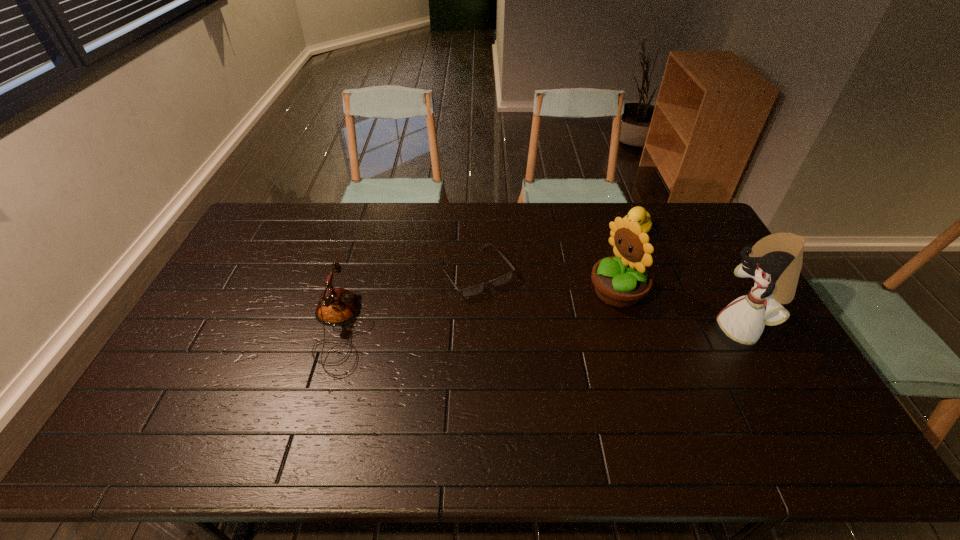
Where is `vacant area situated 0.150m at the front face of the rightmost object`? vacant area situated 0.150m at the front face of the rightmost object is located at coordinates (666, 329).

Locate an element on the screen. This screenshot has width=960, height=540. vacant space located 0.370m on the face of the second tallest object is located at coordinates (493, 352).

The image size is (960, 540). I want to click on vacant space situated 0.350m on the face of the second tallest object, so click(499, 349).

Image resolution: width=960 pixels, height=540 pixels. Identify the location of free space located on the face of the second tallest object. (554, 323).

At what (x,y) coordinates should I click in order to perform the action: click on vacant space located 0.170m on the front-facing side of the shortest object. Please return your answer as a coordinate pair (x, y). Looking at the image, I should click on (522, 336).

This screenshot has height=540, width=960. I want to click on vacant region located 0.210m on the front-facing side of the shortest object, so click(530, 346).

At what (x,y) coordinates should I click in order to perform the action: click on free space located on the front-facing side of the shortest object. Please return your answer as a coordinate pair (x, y). Image resolution: width=960 pixels, height=540 pixels. Looking at the image, I should click on (540, 359).

Where is `vacant space located 0.270m on the beak of the farthest object`? Image resolution: width=960 pixels, height=540 pixels. vacant space located 0.270m on the beak of the farthest object is located at coordinates (587, 278).

Where is `free space located on the beak of the farthest object`? free space located on the beak of the farthest object is located at coordinates [x=612, y=254].

You are a GUI agent. You are given a task and a screenshot of the screen. Output one action in this format:
    pyautogui.click(x=<x>, y=<y>)
    Task: Click on the vacant position located 0.220m on the beak of the farthest object
    
    Given the screenshot: What is the action you would take?
    pyautogui.click(x=594, y=271)